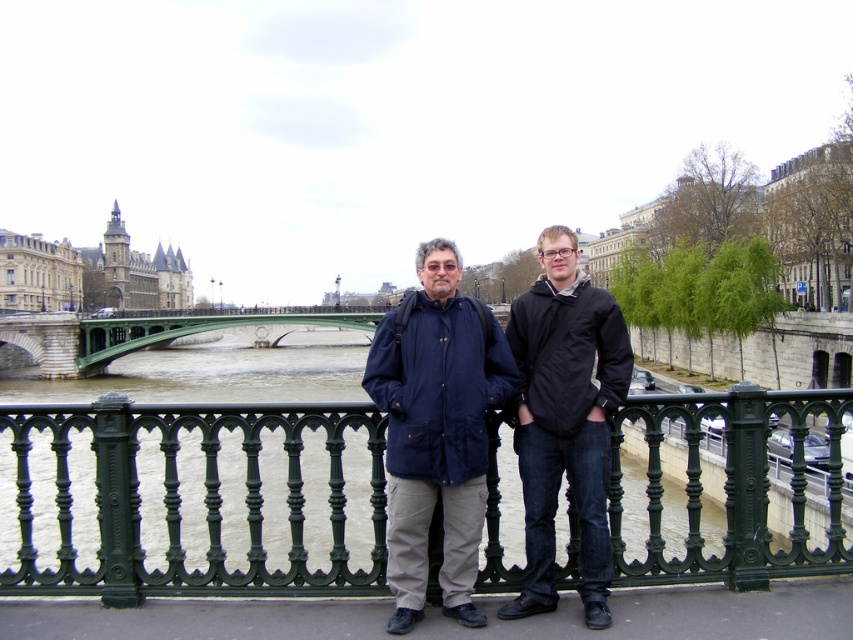
Is black matte jacket at center bigger than stone gothic architecture at upper left?

No.

Who is more forward, (x=596, y=314) or (x=122, y=307)?

Point (x=596, y=314)

The height and width of the screenshot is (640, 853). What are the coordinates of `black matte jacket at center` in the screenshot? It's located at (566, 420).

In order to click on black matte jacket at center in this screenshot , I will do `click(566, 420)`.

Is black matte jacket at center wider than green stone bridge at center?

In fact, black matte jacket at center might be narrower than green stone bridge at center.

Can you confirm if black matte jacket at center is taller than green stone bridge at center?

No.

Where is `black matte jacket at center`? This screenshot has width=853, height=640. black matte jacket at center is located at coordinates (566, 420).

Does matte blue jacket at center appear on the left side of stone gothic architecture at upper left?

In fact, matte blue jacket at center is to the right of stone gothic architecture at upper left.

Between point (389, 353) and point (120, 276), which one is positioned behind?

Positioned behind is point (120, 276).

Does point (618, 394) lie behind point (144, 288)?

No, it is in front of (144, 288).

Find the location of `matte blue jacket at center`. matte blue jacket at center is located at coordinates (436, 429).